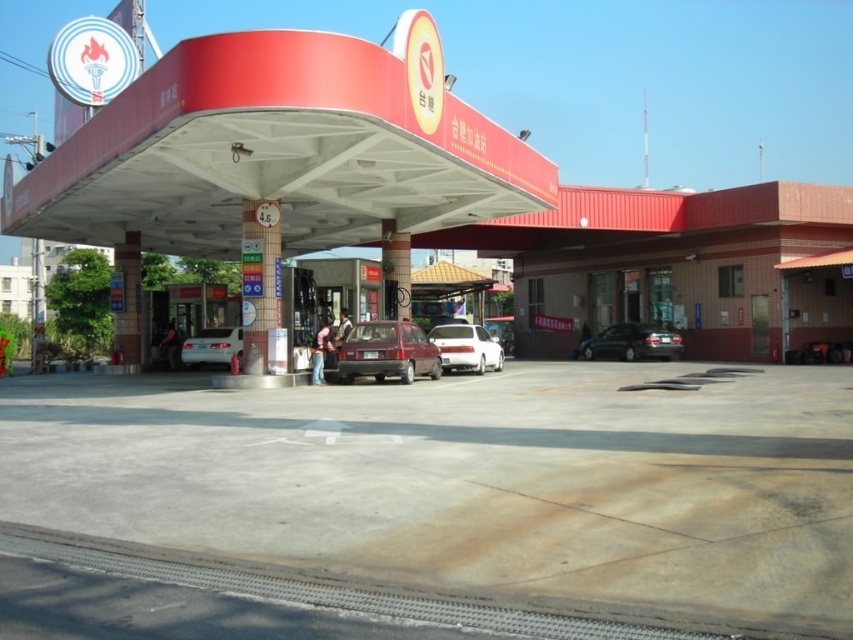
You are a customer at the gas station and want to park your car between the shiny black sedan at center and the satin silver sedan at center. Is this possible given their current positions?

The shiny black sedan at center is positioned on the right side of the satin silver sedan at center, so there is space between them where you can park your car.

You are standing at the gas station and want to locate two specific points marked on the ground. The first point is at coordinates point (x=265, y=332) and the second point is at point (x=457, y=348). Based on the scene description, which point is closer to the entrance of the gas station?

Point (x=265, y=332) is in front of point (x=457, y=348), so it is closer to the entrance of the gas station.